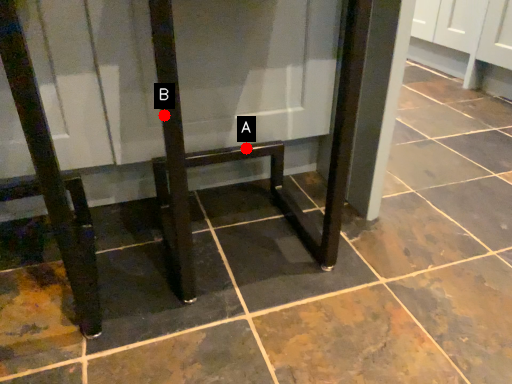
Question: Two points are circled on the image, labeled by A and B beside each circle. Which point is farther to the camera?

Choices:
 (A) A is further
 (B) B is further

Answer: (A)